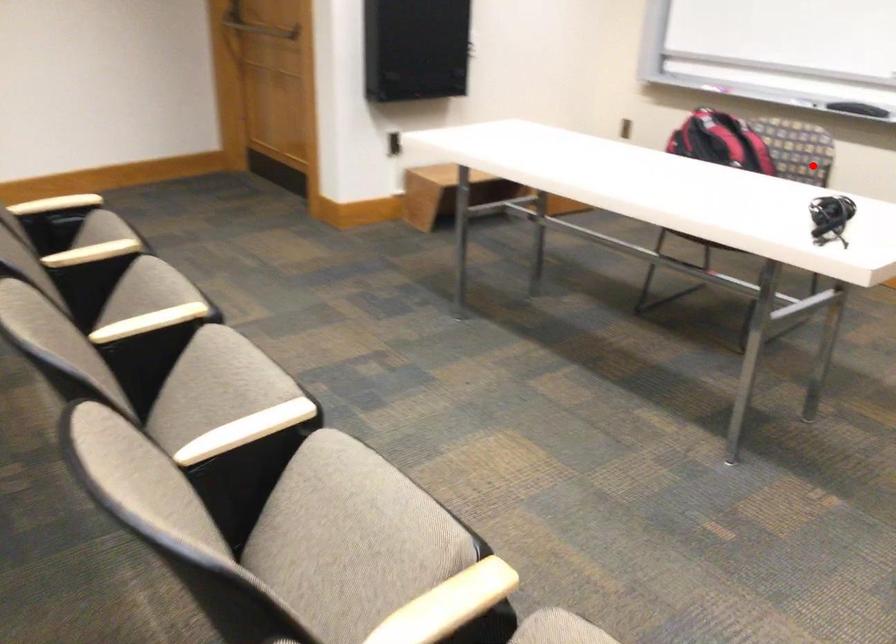
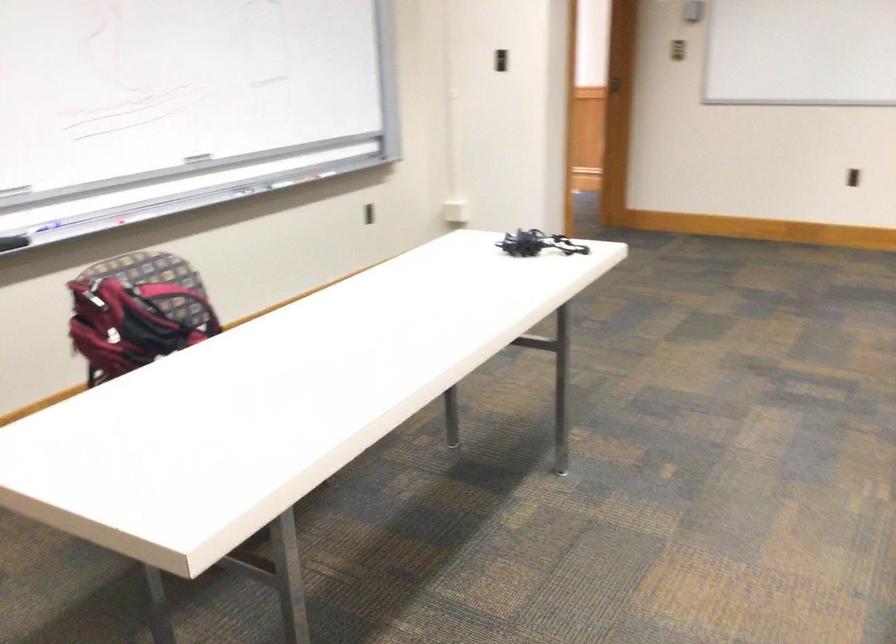
Find the pixel in the second image that matches the highlighted location in the first image.

(177, 301)